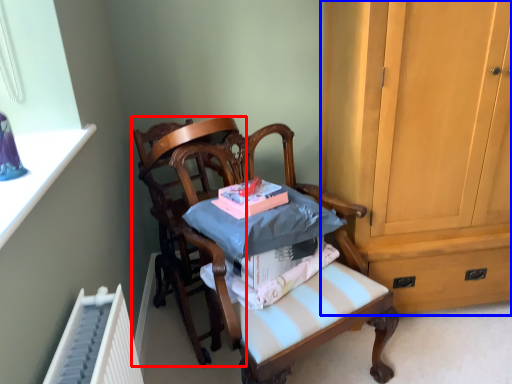
Question: Which of the following is the closest to the observer, chair (highlighted by a red box) or cabinetry (highlighted by a blue box)?

Choices:
 (A) chair
 (B) cabinetry

Answer: (B)